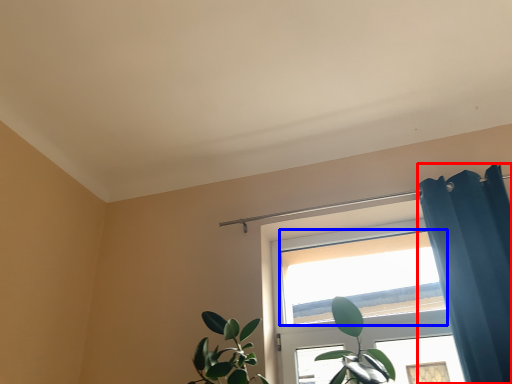
Question: Which object is closer to the camera taking this photo, shower curtain (highlighted by a red box) or window (highlighted by a blue box)?

Choices:
 (A) shower curtain
 (B) window

Answer: (A)